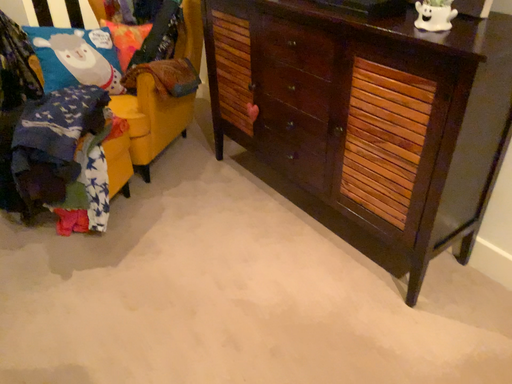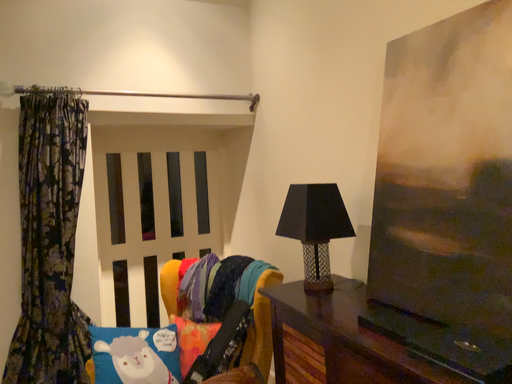
Question: How did the camera likely rotate when shooting the video?

Choices:
 (A) rotated downward
 (B) rotated upward

Answer: (B)